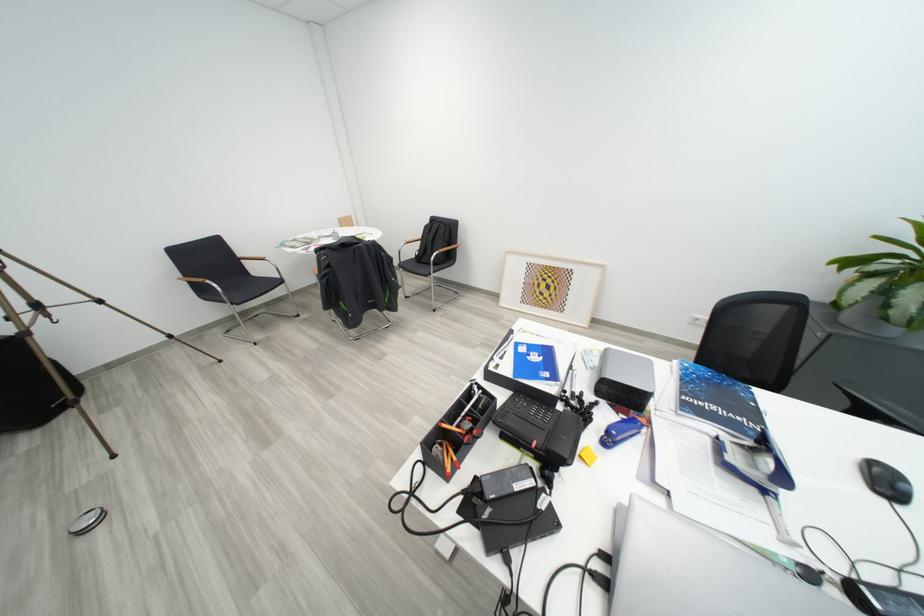
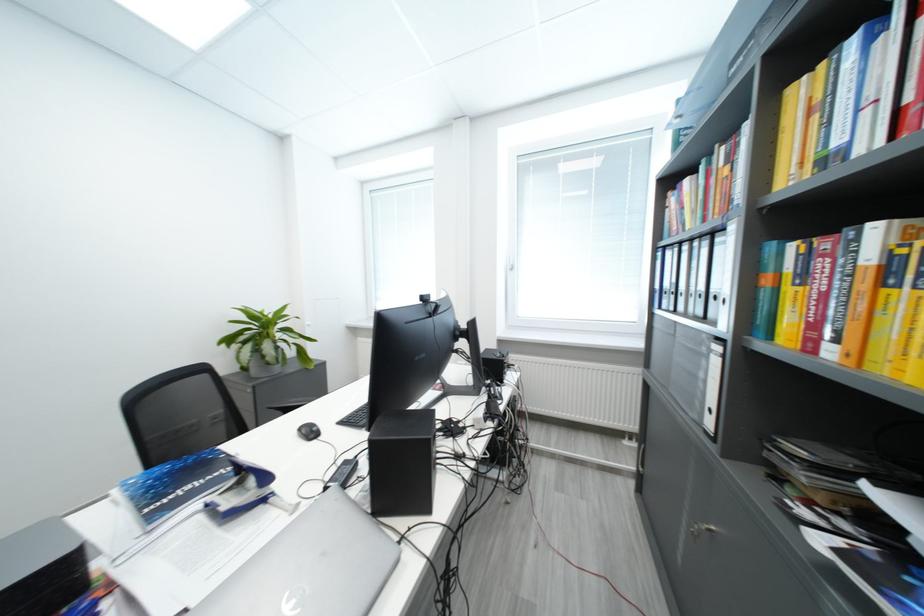
Locate, in the second image, the point that corresponds to [782,533] in the first image.

(293, 517)